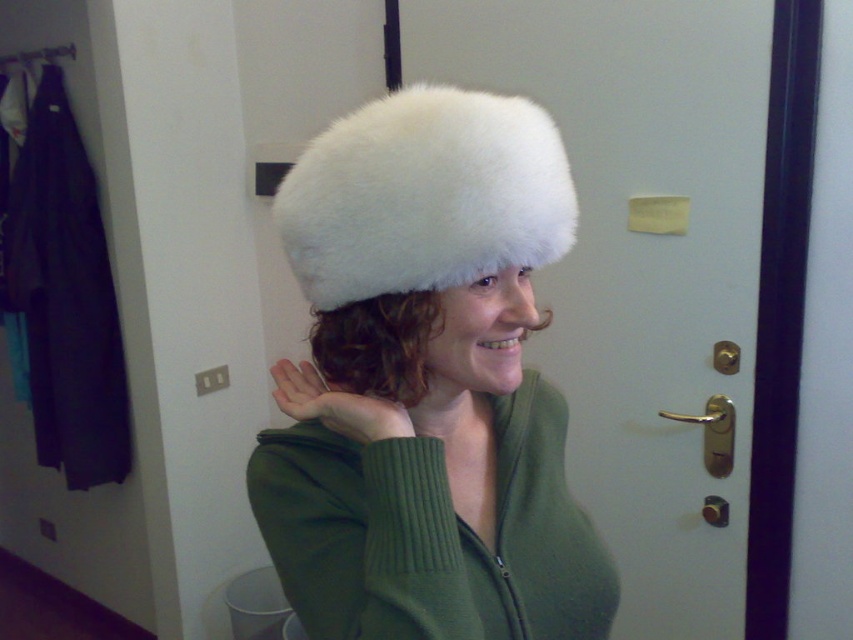
Can you confirm if white furry hat at center is taller than white fluffy hat at center?

Yes.

Does white furry hat at center appear under white fluffy hat at center?

Correct, white furry hat at center is located below white fluffy hat at center.

Does point (473, 444) come behind point (399, 170)?

Yes, point (473, 444) is behind point (399, 170).

This screenshot has width=853, height=640. In order to click on white furry hat at center in this screenshot , I will do `click(427, 384)`.

Which is more to the left, green ribbed sweater at center or black fabric coat at left?

black fabric coat at left is more to the left.

Which of these two, green ribbed sweater at center or black fabric coat at left, stands shorter?

Standing shorter between the two is green ribbed sweater at center.

What do you see at coordinates (432, 532) in the screenshot?
I see `green ribbed sweater at center` at bounding box center [432, 532].

The image size is (853, 640). I want to click on green ribbed sweater at center, so click(432, 532).

Between point (456, 573) and point (479, 220), which one is positioned in front?

Point (456, 573) is more forward.

Is point (496, 516) in front of point (412, 232)?

That is False.

Where is `green ribbed sweater at center`? green ribbed sweater at center is located at coordinates (432, 532).